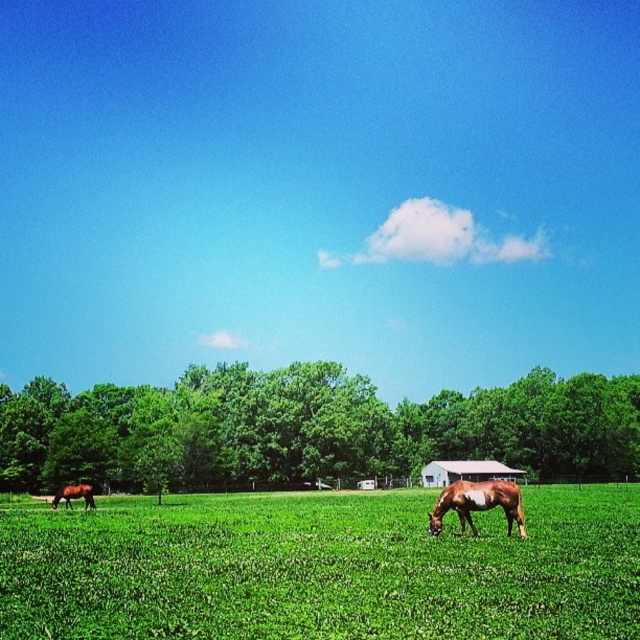
Question: Does white wooden barn at center appear under brown glossy horse at lower left?

Choices:
 (A) no
 (B) yes

Answer: (B)

Question: Can you confirm if brown speckled horse at center is positioned below white wooden barn at center?

Choices:
 (A) no
 (B) yes

Answer: (A)

Question: Estimate the real-world distances between objects in this image. Which object is closer to the green leafy tree at center?

Choices:
 (A) brown speckled horse at center
 (B) brown glossy horse at lower left
 (C) green grass pasture at center
 (D) white wooden barn at center

Answer: (D)

Question: Which object is positioned closest to the green leafy tree at center?

Choices:
 (A) green grass pasture at center
 (B) brown speckled horse at center
 (C) brown glossy horse at lower left

Answer: (B)

Question: Is green leafy tree at center positioned behind brown speckled horse at center?

Choices:
 (A) no
 (B) yes

Answer: (B)

Question: Which of these objects is positioned closest to the brown glossy horse at lower left?

Choices:
 (A) white wooden barn at center
 (B) brown speckled horse at center
 (C) green grass pasture at center
 (D) green leafy tree at center

Answer: (C)